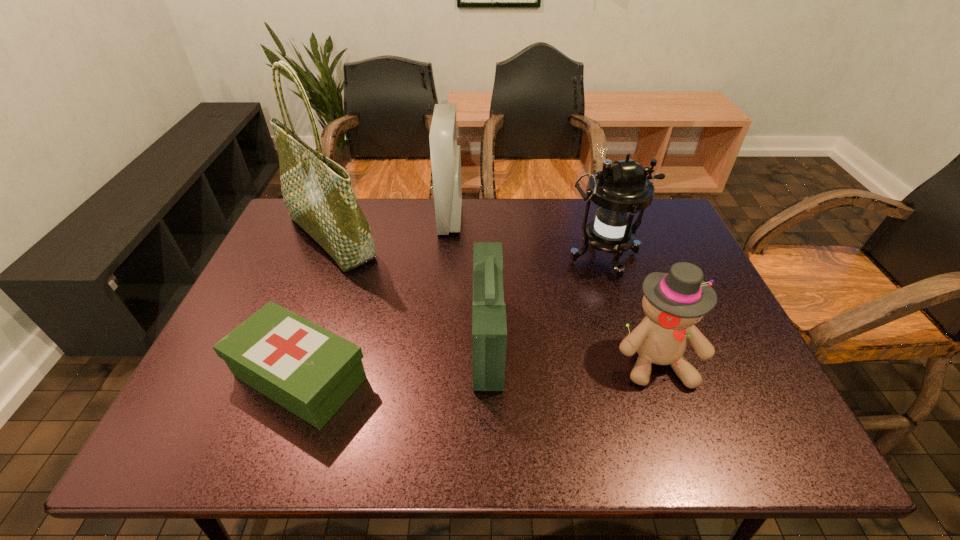
Locate an element on the screen. The height and width of the screenshot is (540, 960). vacant space situated 0.190m on the front-facing side of the farthest first-aid kit is located at coordinates (520, 218).

Where is `vacant space located 0.320m on the front of the lantern`? This screenshot has height=540, width=960. vacant space located 0.320m on the front of the lantern is located at coordinates click(x=642, y=382).

The width and height of the screenshot is (960, 540). Identify the location of vacant space situated 0.090m on the front-facing side of the rag_doll. (682, 430).

Locate an element on the screen. The width and height of the screenshot is (960, 540). vacant space situated 0.400m on the front-facing side of the rightmost first-aid kit is located at coordinates (306, 341).

This screenshot has width=960, height=540. In order to click on vacant space located 0.260m on the front-facing side of the rightmost first-aid kit in this screenshot , I will do `click(365, 341)`.

Where is `vacant space situated 0.270m on the front-facing side of the rightmost first-aid kit`? The height and width of the screenshot is (540, 960). vacant space situated 0.270m on the front-facing side of the rightmost first-aid kit is located at coordinates tap(361, 341).

Locate an element on the screen. blank space located 0.210m on the right of the shortest object is located at coordinates (464, 377).

Image resolution: width=960 pixels, height=540 pixels. In order to click on shopping bag located in the far edge section of the desktop in this screenshot , I will do `click(317, 192)`.

This screenshot has width=960, height=540. Identify the location of the first-aid kit situated at the far edge. (445, 153).

At what (x,y) coordinates should I click in order to perform the action: click on lantern that is at the far edge. Please return your answer as a coordinate pair (x, y). The width and height of the screenshot is (960, 540). Looking at the image, I should click on (620, 190).